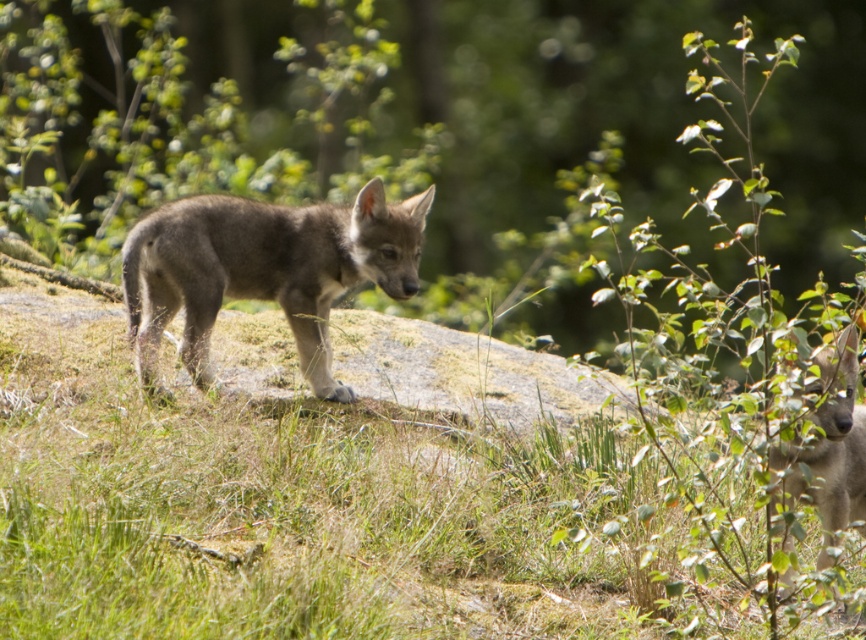
Question: From the image, what is the correct spatial relationship of green grassy at center in relation to gray fur wolf pup at center?

Choices:
 (A) right
 (B) left

Answer: (A)

Question: Does green grassy at center appear over gray fur wolf pup at center?

Choices:
 (A) yes
 (B) no

Answer: (B)

Question: Which of these objects is positioned farthest from the gray fur wolf pup at center?

Choices:
 (A) green grassy at center
 (B) gray fur dog at right

Answer: (B)

Question: Is green grassy at center in front of gray fur wolf pup at center?

Choices:
 (A) no
 (B) yes

Answer: (B)

Question: Among these objects, which one is nearest to the camera?

Choices:
 (A) gray fur wolf pup at center
 (B) gray fur dog at right

Answer: (B)

Question: Among these objects, which one is farthest from the camera?

Choices:
 (A) gray fur wolf pup at center
 (B) gray fur dog at right
 (C) green grassy at center

Answer: (A)